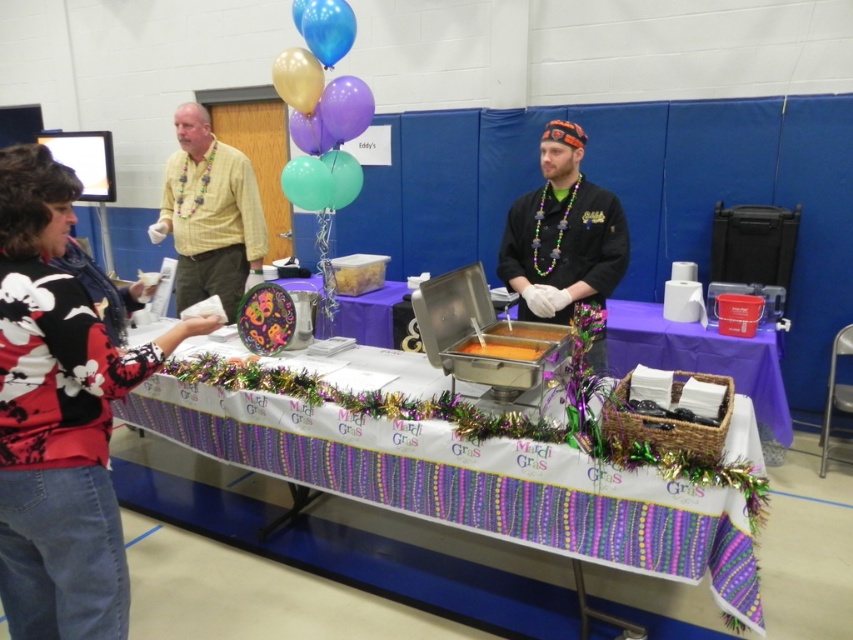
Can you confirm if gold metallic balloon at upper center is positioned below metallic purple balloon at upper center?

Incorrect, gold metallic balloon at upper center is not positioned below metallic purple balloon at upper center.

Can you confirm if gold metallic balloon at upper center is shorter than metallic purple balloon at upper center?

→ In fact, gold metallic balloon at upper center may be taller than metallic purple balloon at upper center.

Does point (271, 68) lie behind point (306, 140)?

No, (271, 68) is in front of (306, 140).

At what (x,y) coordinates should I click in order to perform the action: click on gold metallic balloon at upper center. Please return your answer as a coordinate pair (x, y). The width and height of the screenshot is (853, 640). Looking at the image, I should click on (299, 77).

Is translucent glossy balloon at center further to camera compared to metallic purple balloon at upper center?

No, translucent glossy balloon at center is in front of metallic purple balloon at upper center.

Between point (297, 202) and point (299, 125), which one is positioned in front?

Point (297, 202) is more forward.

Is point (288, 192) positioned behind point (303, 148)?

That is False.

Find the location of a particular element. Image resolution: width=853 pixels, height=640 pixels. translucent glossy balloon at center is located at coordinates click(x=306, y=182).

Does yellow striped shirt at left appear on the right side of gold metallic balloon at upper center?

No, yellow striped shirt at left is not to the right of gold metallic balloon at upper center.

The height and width of the screenshot is (640, 853). What do you see at coordinates (209, 214) in the screenshot?
I see `yellow striped shirt at left` at bounding box center [209, 214].

Who is more forward, (225, 173) or (316, 100)?

Point (316, 100) is more forward.

Image resolution: width=853 pixels, height=640 pixels. I want to click on yellow striped shirt at left, so click(x=209, y=214).